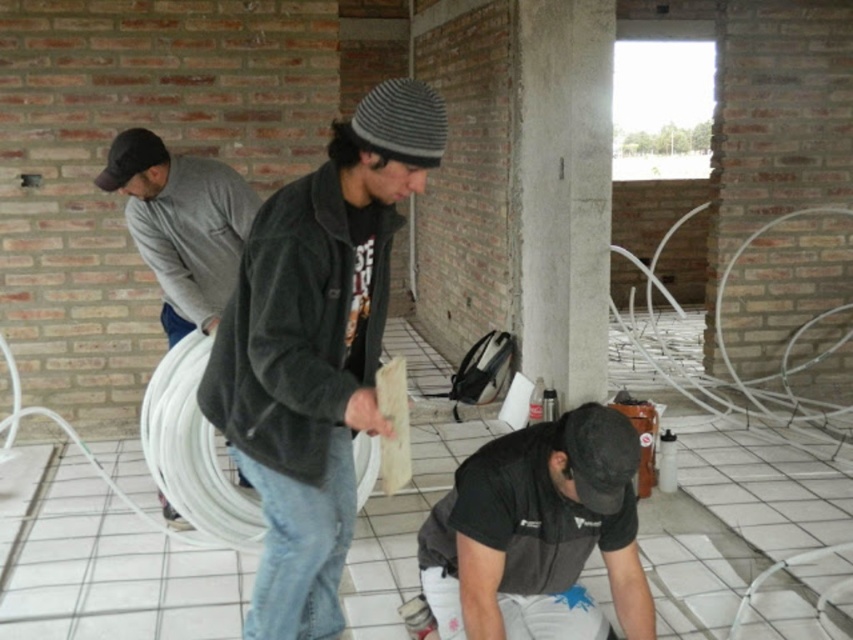
Based on the photo, is dark gray fleece jacket at center above black matte shirt at lower center?

Correct, dark gray fleece jacket at center is located above black matte shirt at lower center.

Does point (364, 317) come in front of point (512, 541)?

Yes.

What are the coordinates of `dark gray fleece jacket at center` in the screenshot? It's located at (300, 324).

At what (x,y) coordinates should I click in order to perform the action: click on dark gray corduroy jacket at center. Please return your answer as a coordinate pair (x, y). Looking at the image, I should click on (316, 349).

Who is taller, dark gray corduroy jacket at center or gray sweater at left?

dark gray corduroy jacket at center

Is point (312, 436) in front of point (234, 193)?

Yes, point (312, 436) is in front of point (234, 193).

Locate an element on the screen. The height and width of the screenshot is (640, 853). dark gray corduroy jacket at center is located at coordinates (316, 349).

Who is positioned more to the right, dark gray corduroy jacket at center or dark gray fleece jacket at center?

Positioned to the right is dark gray corduroy jacket at center.

Does point (328, 365) come farther from viewer compared to point (312, 257)?

Yes, point (328, 365) is behind point (312, 257).

In order to click on dark gray corduroy jacket at center in this screenshot , I will do `click(316, 349)`.